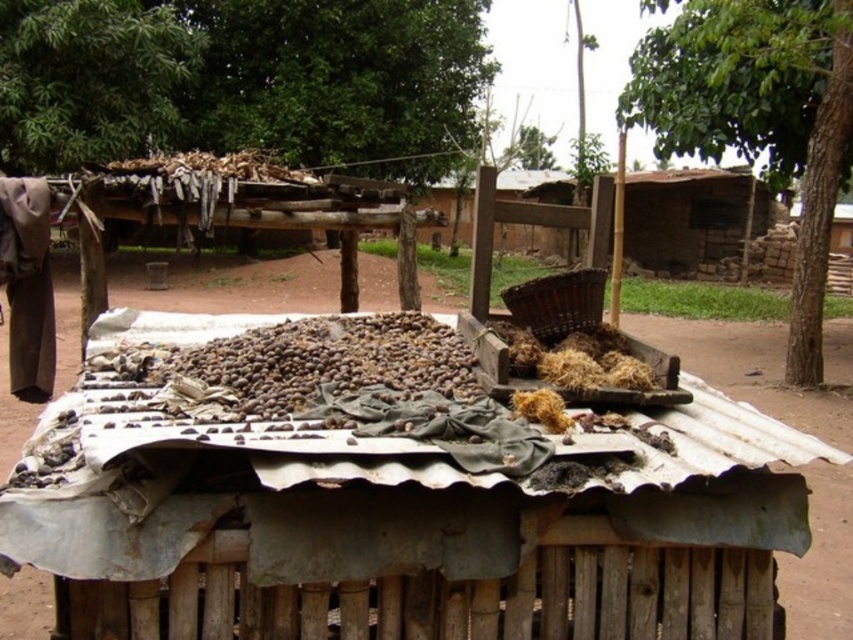
What do you see at coordinates (300, 369) in the screenshot? This screenshot has height=640, width=853. I see `brown matte nuts at center` at bounding box center [300, 369].

Where is `brown matte nuts at center`? The height and width of the screenshot is (640, 853). brown matte nuts at center is located at coordinates (300, 369).

Is brown dirt field at center below brown matte nuts at center?

Actually, brown dirt field at center is above brown matte nuts at center.

From the picture: Who is more forward, [759,385] or [132,356]?

Positioned in front is point [132,356].

In order to click on brown dirt field at center in this screenshot , I will do `click(759, 368)`.

Can you confirm if brown matte nuts at center is positioned above brown woven basket at center?

No.

The image size is (853, 640). Describe the element at coordinates (300, 369) in the screenshot. I see `brown matte nuts at center` at that location.

Locate an element on the screen. brown matte nuts at center is located at coordinates (300, 369).